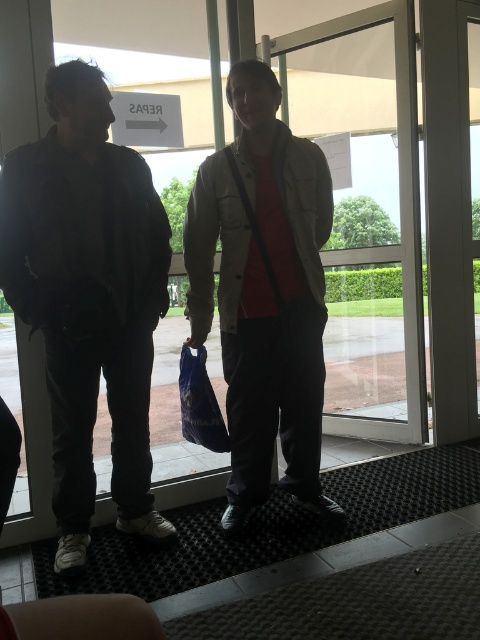
You are standing at the entrance of the building and see the two people. Which object is located at the coordinates point (88, 298)?

The point (88, 298) is on the matte black jacket at left.